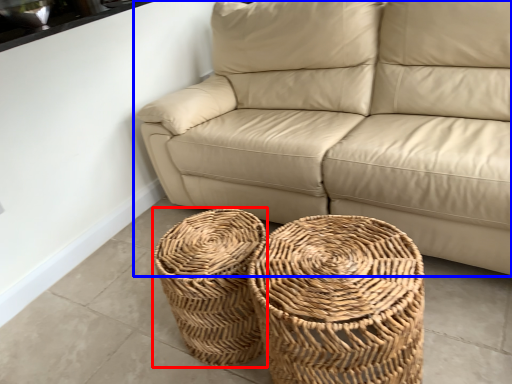
Question: Which object is closer to the camera taking this photo, basket (highlighted by a red box) or studio couch (highlighted by a blue box)?

Choices:
 (A) basket
 (B) studio couch

Answer: (B)